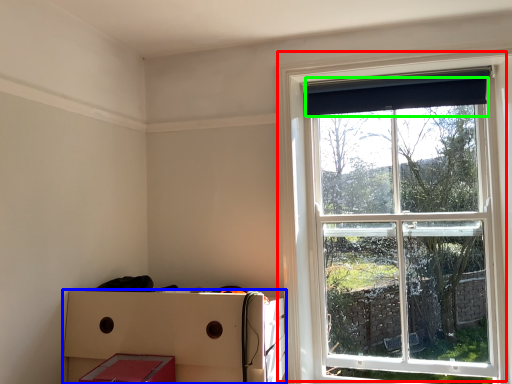
Question: Estimate the real-world distances between objects in this image. Which object is closer to window (highlighted by a red box), crate (highlighted by a blue box) or curtain (highlighted by a green box)?

Choices:
 (A) crate
 (B) curtain

Answer: (B)